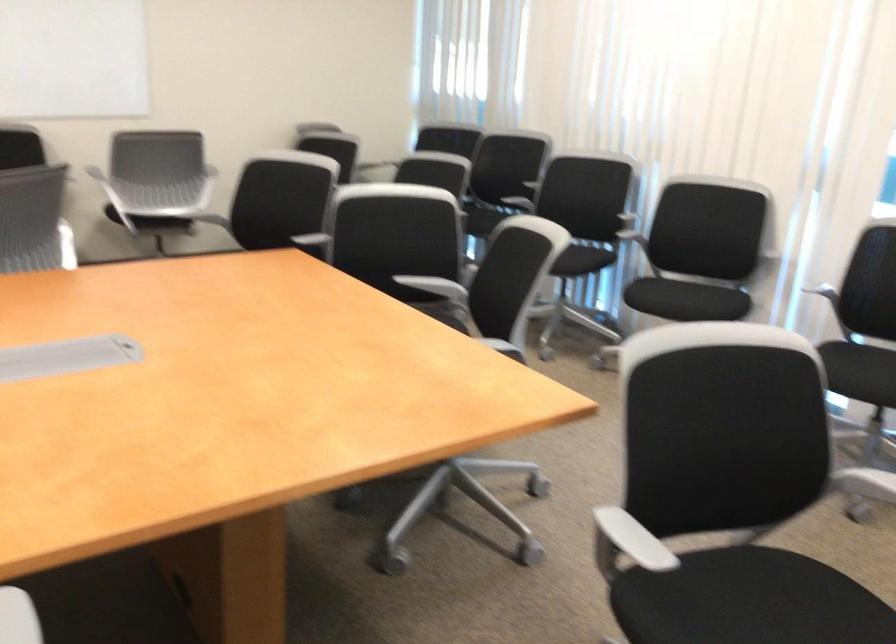
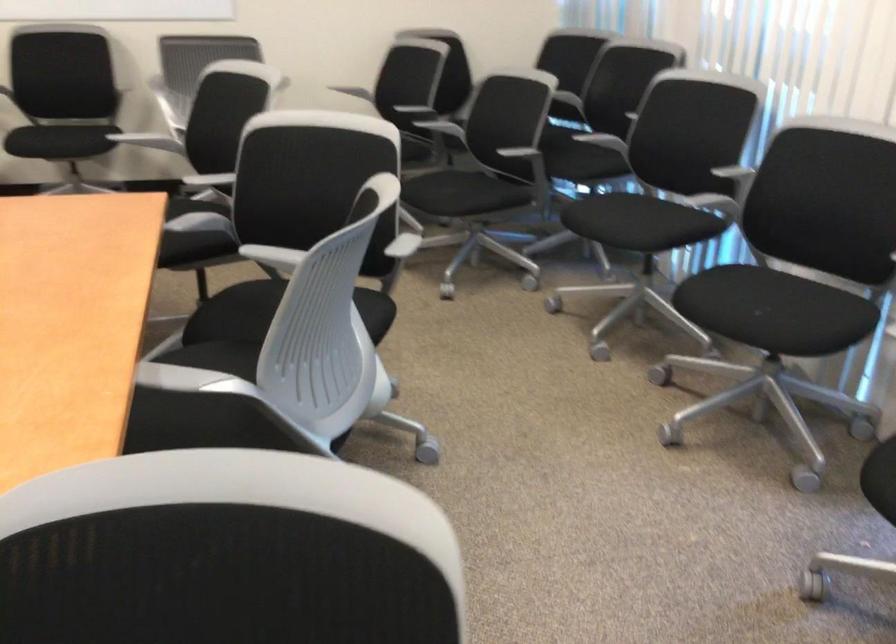
Locate, in the second image, the point that corresponds to the point at 623,227 in the first image.

(726, 193)